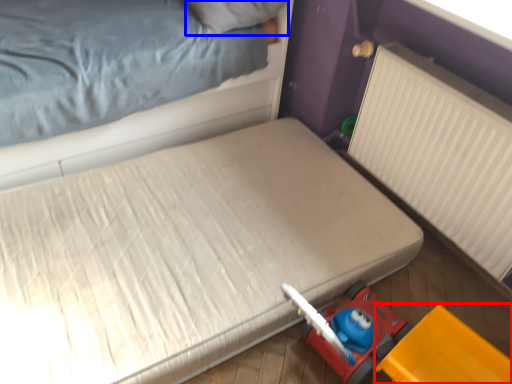
Question: Among these objects, which one is nearest to the camera, equipment (highlighted by a red box) or pillow (highlighted by a blue box)?

Choices:
 (A) equipment
 (B) pillow

Answer: (A)